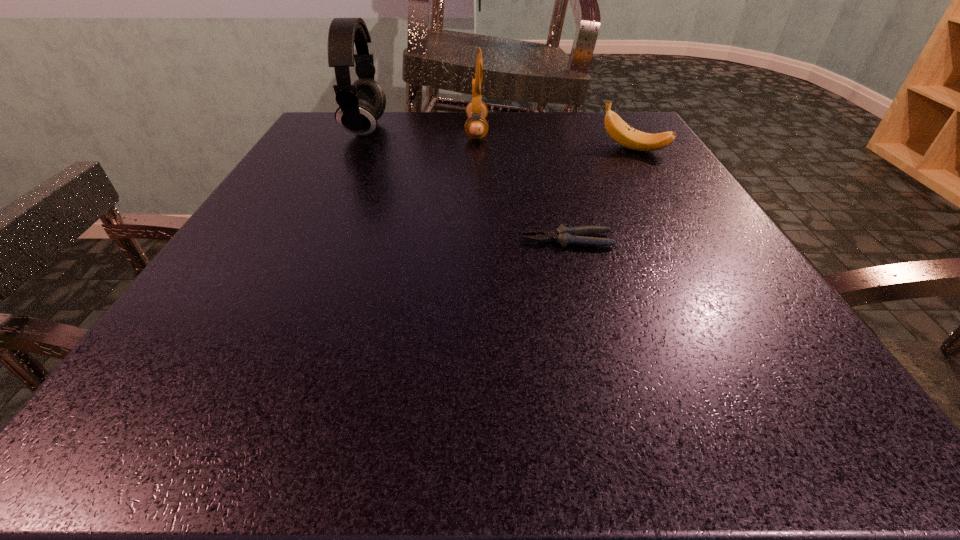
Find the location of a particular element. The width and height of the screenshot is (960, 540). the left earphone is located at coordinates (361, 104).

I want to click on the tallest object, so click(x=361, y=104).

Locate an element on the screen. Image resolution: width=960 pixels, height=540 pixels. the third object from right to left is located at coordinates (476, 127).

The width and height of the screenshot is (960, 540). What are the coordinates of `the third shortest object` in the screenshot? It's located at (476, 127).

Where is `the rightmost object`? The height and width of the screenshot is (540, 960). the rightmost object is located at coordinates click(622, 133).

This screenshot has width=960, height=540. I want to click on the third tallest object, so click(622, 133).

Find the location of `pliers`. pliers is located at coordinates (564, 235).

Where is `the nearest object`? This screenshot has width=960, height=540. the nearest object is located at coordinates (564, 235).

You are a GUI agent. You are given a task and a screenshot of the screen. Output one action in this format:
    pyautogui.click(x=<x>, y=<y>)
    Task: Click on the free point located 0.260m on the ear cups of the tallest object
    
    Given the screenshot: What is the action you would take?
    pyautogui.click(x=495, y=130)

I want to click on vacant space situated 0.160m on the front-facing side of the third object from right to left, so click(557, 131).